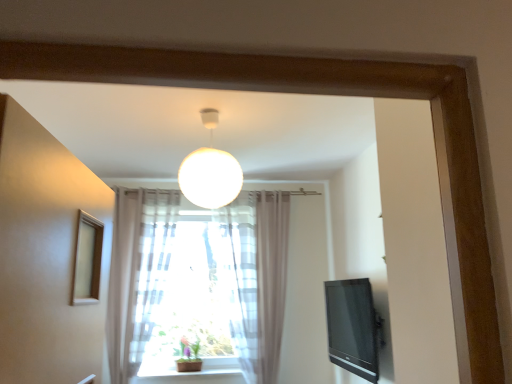
Question: Is white matte sphere at center inside the boundaries of black glossy tv at right, or outside?

Choices:
 (A) inside
 (B) outside

Answer: (B)

Question: In the image, is white matte sphere at center positioned in front of or behind black glossy tv at right?

Choices:
 (A) behind
 (B) front

Answer: (B)

Question: Based on their relative distances, which object is nearer to the white matte sphere at center?

Choices:
 (A) translucent fabric curtain at lower center
 (B) black glossy tv at right
 (C) green matte plant at center

Answer: (A)

Question: Which object is positioned closest to the green matte plant at center?

Choices:
 (A) black glossy tv at right
 (B) translucent fabric curtain at lower center
 (C) white matte sphere at center

Answer: (B)